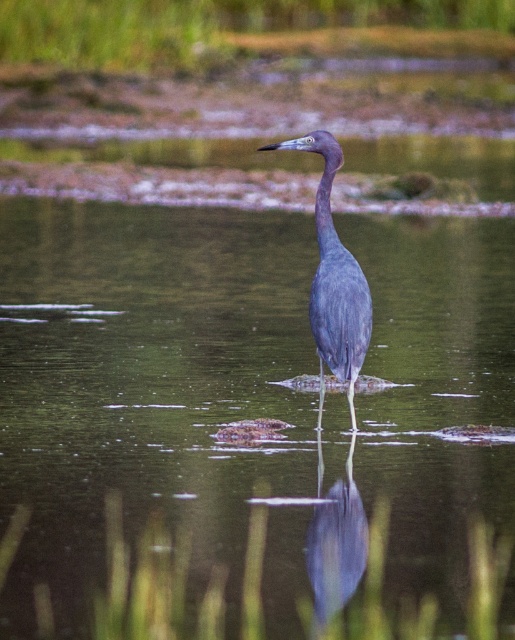
You are a photographer trying to capture the smooth gray heron at center. You notice the clear water at center in the background. From the heron, which direction should you move to get a better shot of the water reflecting the heron?

The clear water at center is to the left of the smooth gray heron at center, so to capture the reflection, you should move to the left side of the heron to position yourself where the water is located for the best reflection shot.

You are a photographer aiming to capture the satin blue heron at center in the image. Since you want to focus on the bird, you need to adjust your camera settings to ensure the clear water at center doesn not overpower the heron. Based on their sizes, which object should you prioritize in your composition?

The clear water at center is bigger than the satin blue heron at center, so you should prioritize focusing on the satin blue heron at center to ensure it remains the main subject despite its smaller size.